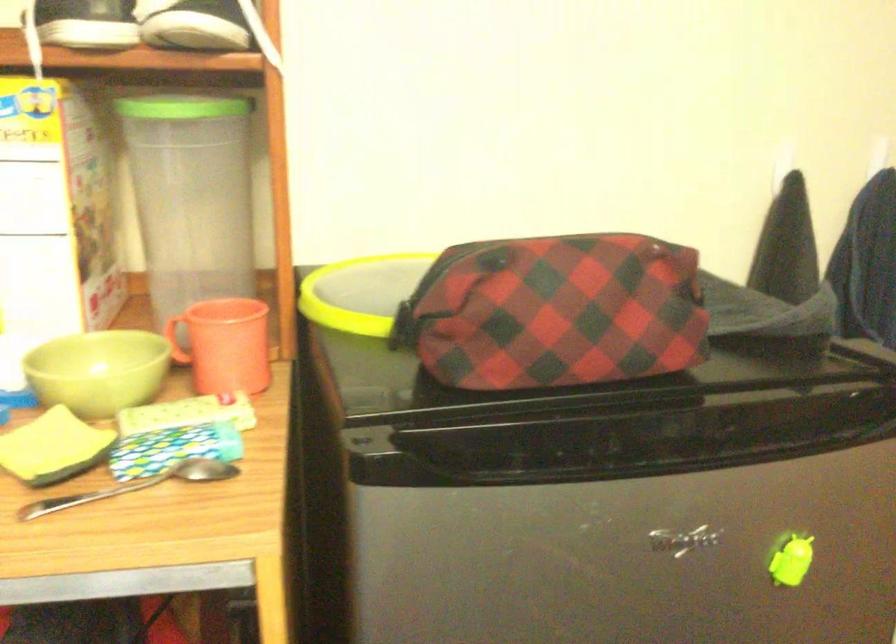
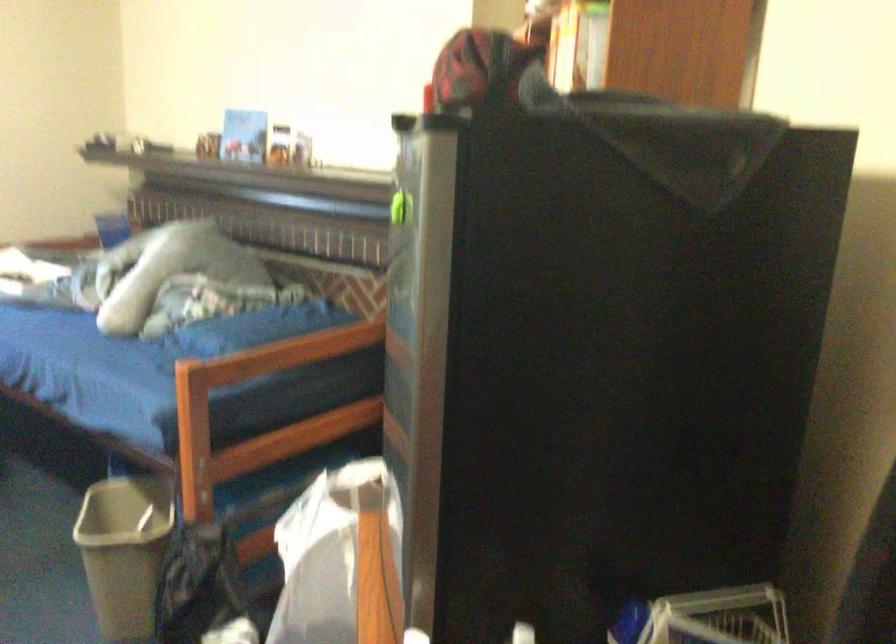
Question: I am providing you with two images of the same scene from different viewpoints. After the viewpoint changes to image2, which objects are now occluded?

Choices:
 (A) orange mug handle
 (B) red and black cap
 (C) green magnetic clip
 (D) red mop handle

Answer: (A)